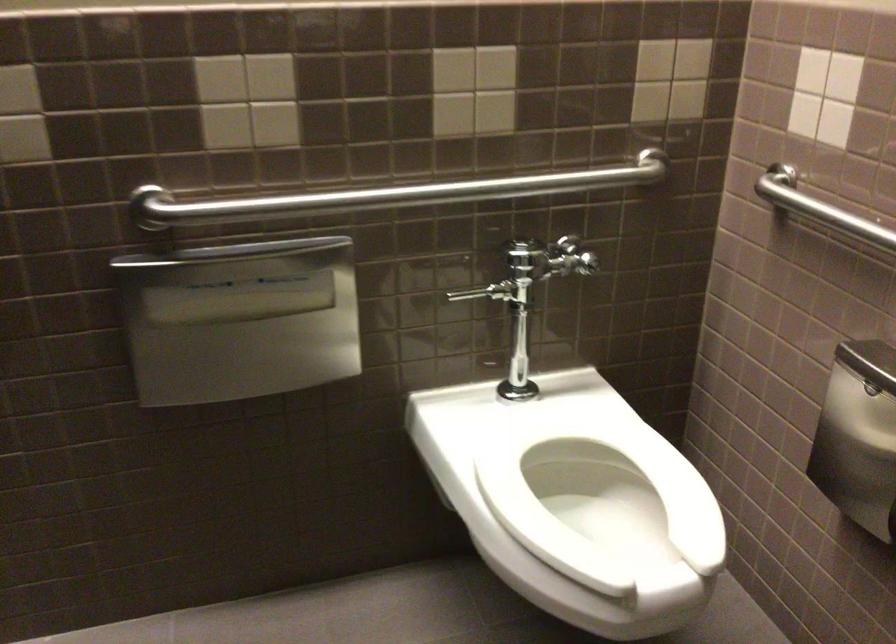
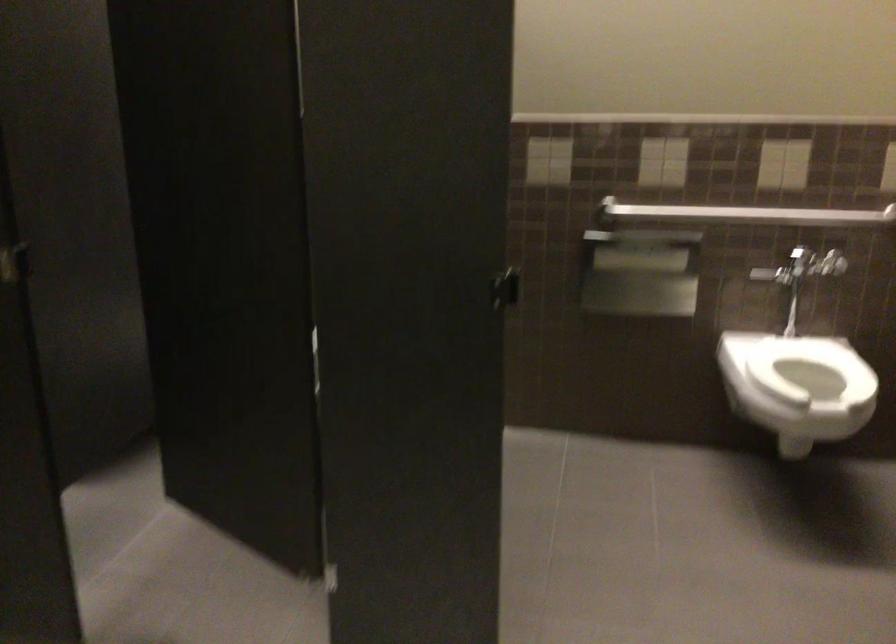
Locate, in the second image, the point that corresponds to point 555,468 in the first image.

(810, 368)